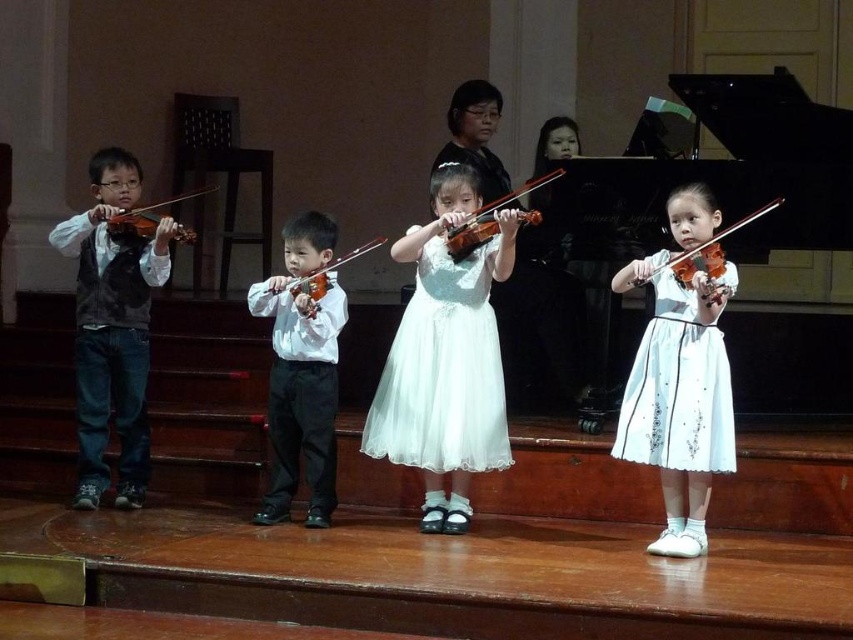
You are a stagehand who needs to place a microphone stand at the exact center of the stage. The stage has a coordinate system where the bottom left corner is at point 0,0 and the top right corner is at 1,1. You see the matte orange violin at center. What are the coordinates of the stage center?

The coordinates of the stage center are at point (x=426, y=320). The matte orange violin at center is located at point (x=701, y=252), which is not exactly at the stage center. To place the microphone stand at the exact center, you should position it at (x=426, y=320).

You are a photographer taking a picture of the stage during the music recital. You notice a point at coordinates (x=300, y=372) on the stage. What object is located at this point?

The point at coordinates (x=300, y=372) corresponds to the white smooth shirt at center.

You are a stagehand who needs to place a 1.2 meter long banner between the white glossy violin at center and the matte brown violin at center. Can you fit the banner between them without moving the violins?

The distance between the white glossy violin at center and the matte brown violin at center is 1.05 meters. Since the banner is 1.2 meters long, it cannot fit between them without moving the violins because the banner is longer than the space available.